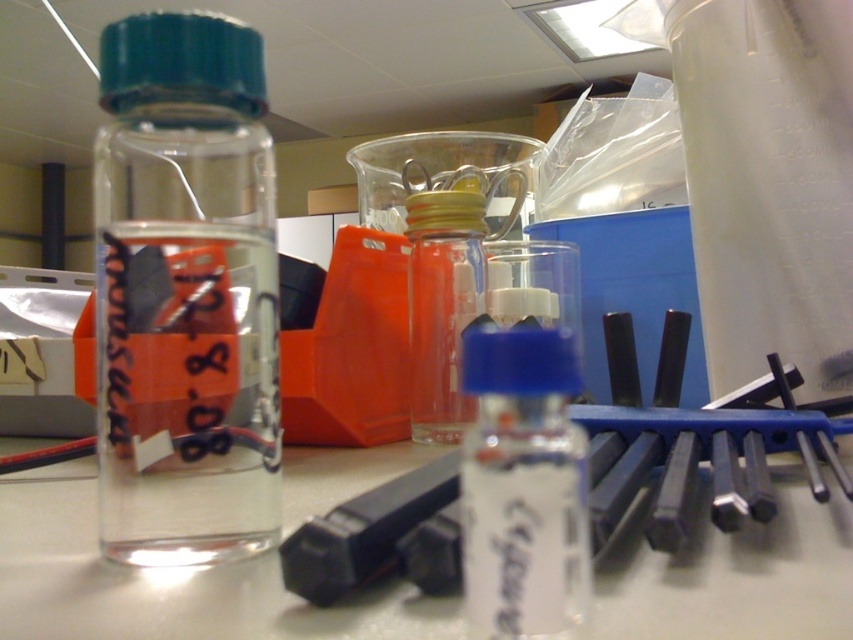
Question: Can you confirm if transparent glass bottle at left is positioned below transparent plastic vial at center?

Choices:
 (A) yes
 (B) no

Answer: (B)

Question: Which of the following is the farthest from the observer?

Choices:
 (A) transparent glass bottle at center
 (B) transparent glass table at center
 (C) transparent glass bottle at left
 (D) transparent plastic vial at center

Answer: (A)

Question: Does transparent glass bottle at left have a greater width compared to transparent glass table at center?

Choices:
 (A) yes
 (B) no

Answer: (B)

Question: Does transparent glass bottle at left appear over transparent glass bottle at center?

Choices:
 (A) yes
 (B) no

Answer: (A)

Question: Which of the following is the farthest from the observer?

Choices:
 (A) transparent glass bottle at left
 (B) transparent glass table at center

Answer: (A)

Question: Estimate the real-world distances between objects in this image. Which object is farther from the transparent glass table at center?

Choices:
 (A) transparent plastic vial at center
 (B) transparent glass bottle at center

Answer: (B)